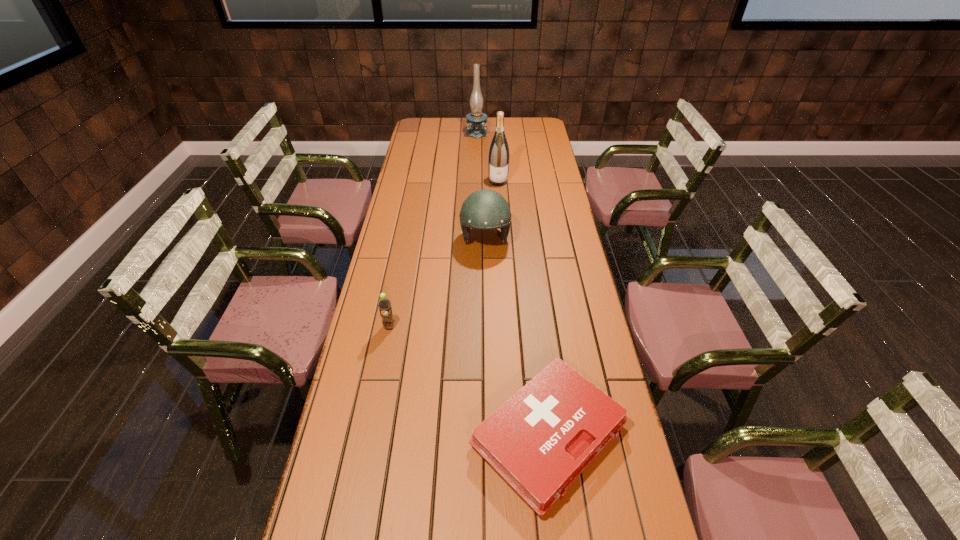
Where is `empty location between the farthest object and the third farthest object`? This screenshot has height=540, width=960. empty location between the farthest object and the third farthest object is located at coordinates (481, 186).

Identify the location of free space between the second nearest object and the wine bottle. Image resolution: width=960 pixels, height=540 pixels. (444, 254).

The image size is (960, 540). I want to click on vacant space that is in between the farthest object and the wine bottle, so click(x=488, y=157).

This screenshot has height=540, width=960. What are the coordinates of `vacant space in between the third tallest object and the farthest object` in the screenshot? It's located at (481, 186).

The width and height of the screenshot is (960, 540). Find the location of `free spot between the leftmost object and the nearest object`. free spot between the leftmost object and the nearest object is located at coordinates (468, 381).

What are the coordinates of `unoccupied position between the football helmet and the farthest object` in the screenshot? It's located at (481, 186).

I want to click on empty space between the football helmet and the second nearest object, so click(437, 283).

The width and height of the screenshot is (960, 540). Find the location of `vacant area between the football helmet and the shortest object`. vacant area between the football helmet and the shortest object is located at coordinates (516, 337).

Choose which object is the third nearest neighbor to the fourth farthest object. Please provide its 2D coordinates. Your answer should be formatted as a tuple, i.e. [(x, y)], where the tuple contains the x and y coordinates of a point satisfying the conditions above.

[(499, 155)]

Point out which object is positioned as the fourth nearest to the nearest object. Please provide its 2D coordinates. Your answer should be formatted as a tuple, i.e. [(x, y)], where the tuple contains the x and y coordinates of a point satisfying the conditions above.

[(476, 121)]